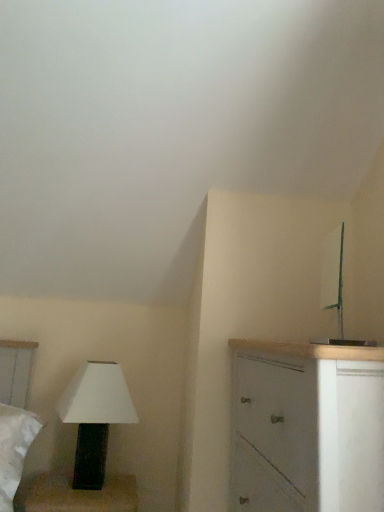
Question: Visually, is white matte cabinet at right positioned to the left or to the right of white matte lamp at lower left?

Choices:
 (A) right
 (B) left

Answer: (A)

Question: Would you say white matte cabinet at right is inside or outside white matte lamp at lower left?

Choices:
 (A) inside
 (B) outside

Answer: (B)

Question: From the image's perspective, is white matte cabinet at right positioned above or below white matte lamp at lower left?

Choices:
 (A) above
 (B) below

Answer: (A)

Question: From a real-world perspective, is white matte lamp at lower left above or below white matte cabinet at right?

Choices:
 (A) above
 (B) below

Answer: (B)

Question: Based on their positions, is white matte lamp at lower left located to the left or right of white matte cabinet at right?

Choices:
 (A) right
 (B) left

Answer: (B)

Question: From the image's perspective, is white matte lamp at lower left located above or below white matte cabinet at right?

Choices:
 (A) below
 (B) above

Answer: (A)

Question: From their relative heights in the image, would you say white matte lamp at lower left is taller or shorter than white matte cabinet at right?

Choices:
 (A) tall
 (B) short

Answer: (B)